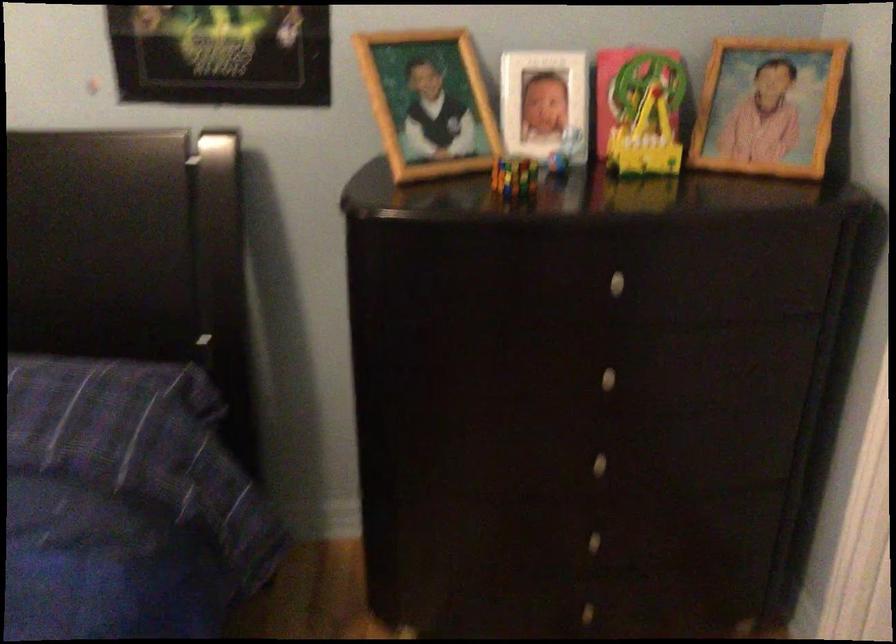
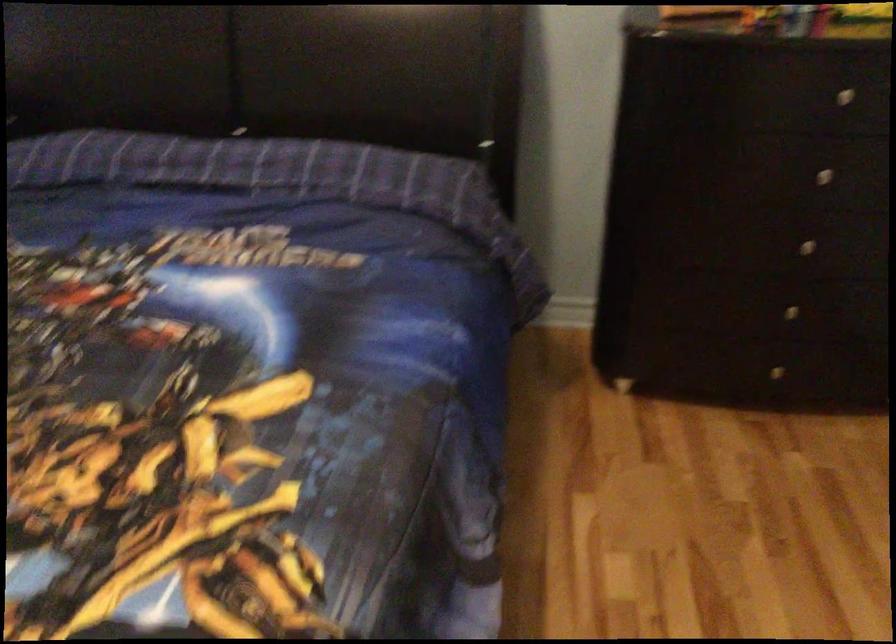
In the second image, find the point that corresponds to (x=605, y=460) in the first image.

(805, 245)